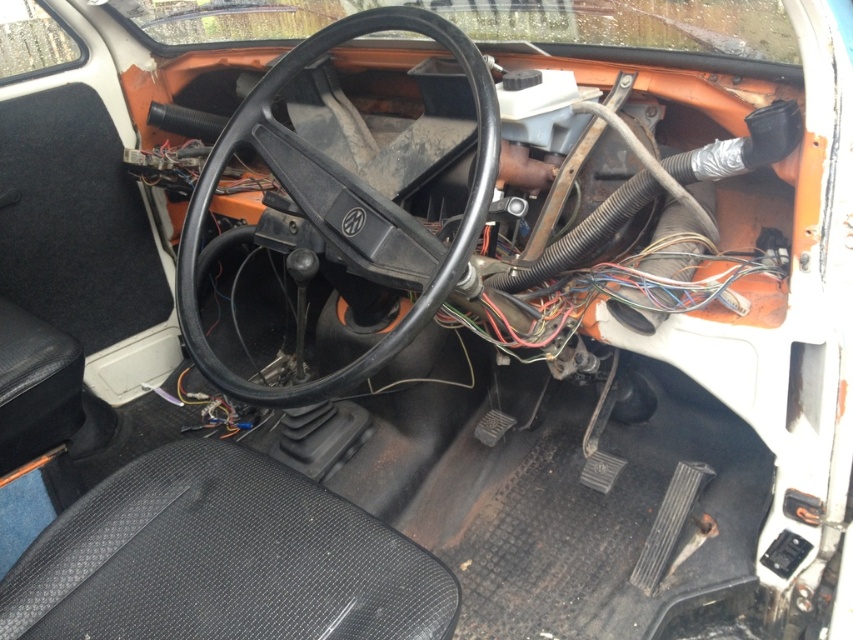
You are sitting in the driver seat of the Volkswagen vehicle shown. There is a point at coordinates point (x=222, y=560). Which object in the scene does this point correspond to?

The point (x=222, y=560) corresponds to the black textured seat at lower left.

You are a mechanic working on a Volkswagen vehicle. You need to access the gear shift lever located centrally between the pedals. To do so, you must move either the black textured seat at lower left or the black matte steering wheel at center. Which object should you move, and why?

You should move the black textured seat at lower left because it is positioned to the left of the black matte steering wheel at center, making it easier to access the gear shift lever without disturbing the steering wheel.